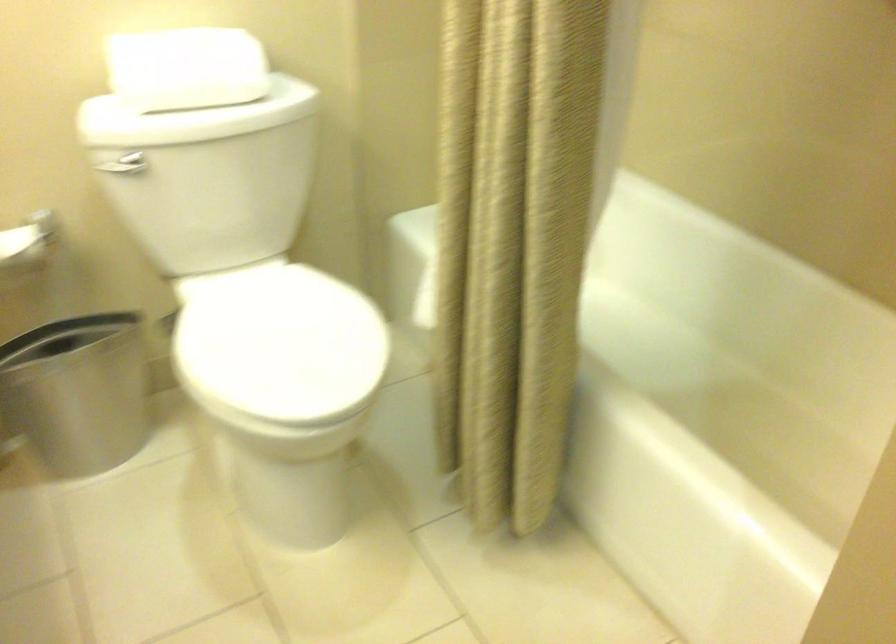
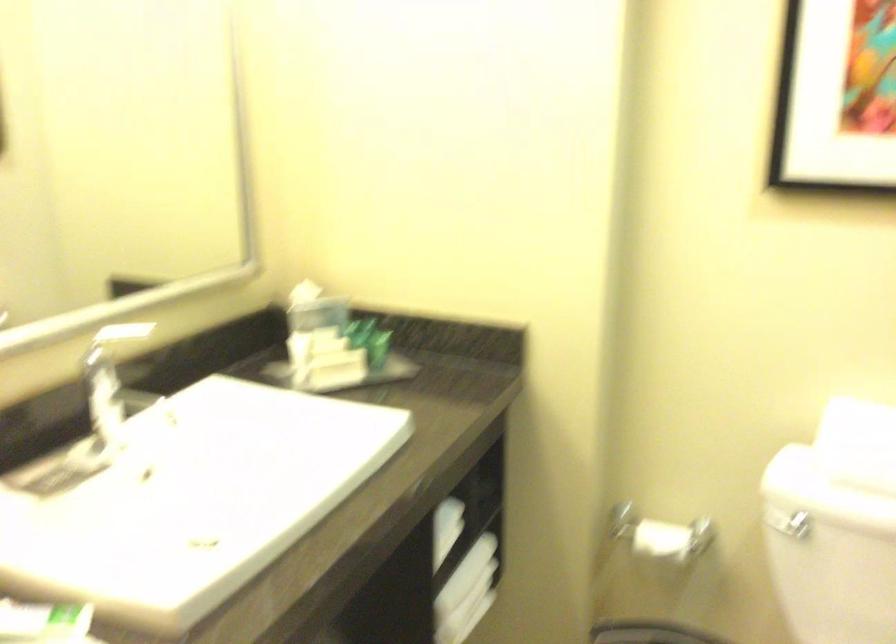
Question: The camera is either moving clockwise (left) or counter-clockwise (right) around the object. The first image is from the beginning of the video and the second image is from the end. Is the camera moving left or right when shooting the video?

Choices:
 (A) Left
 (B) Right

Answer: (B)